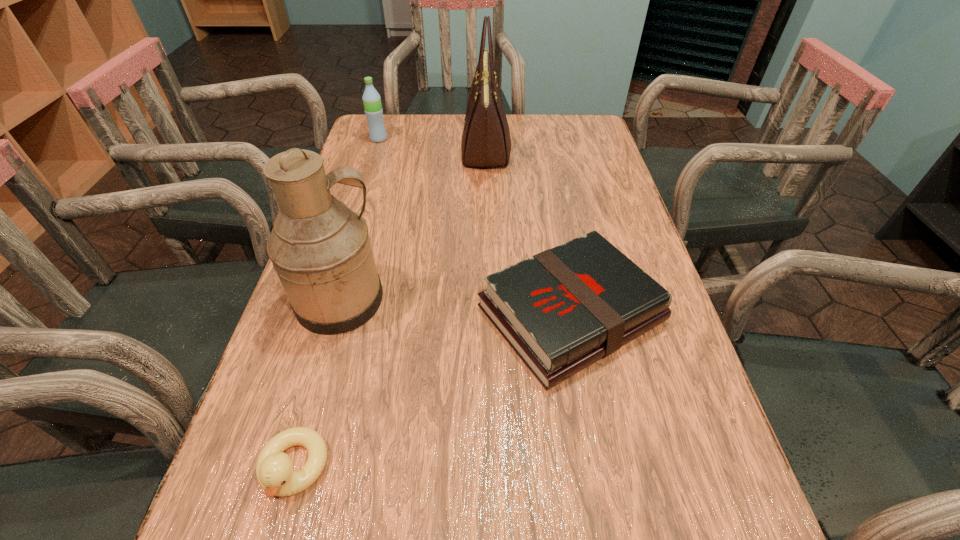
Where is `free location located 0.080m on the left of the hardback book`? free location located 0.080m on the left of the hardback book is located at coordinates (438, 314).

At what (x,y) coordinates should I click in order to perform the action: click on handbag at the far edge. Please return your answer as a coordinate pair (x, y). The height and width of the screenshot is (540, 960). Looking at the image, I should click on (486, 143).

Identify the location of water bottle located in the far edge section of the desktop. (371, 99).

Locate an element on the screen. pitcher that is at the left edge is located at coordinates (321, 250).

Where is `water bottle situated at the left edge`? Image resolution: width=960 pixels, height=540 pixels. water bottle situated at the left edge is located at coordinates (371, 99).

You are a GUI agent. You are given a task and a screenshot of the screen. Output one action in this format:
    pyautogui.click(x=<x>, y=<y>)
    Task: Click on the duckling positioned at the left edge
    The image size is (960, 540).
    Given the screenshot: What is the action you would take?
    pyautogui.click(x=274, y=469)

Find the location of `object situated at the right edge`. object situated at the right edge is located at coordinates (561, 310).

I want to click on object that is at the far left corner, so (x=371, y=99).

In the image, there is a desktop. Identify the location of vacant space at the far edge. (534, 148).

In the image, there is a desktop. At what (x,y) coordinates should I click in order to perform the action: click on vacant space at the left edge. Please return your answer as a coordinate pair (x, y). The width and height of the screenshot is (960, 540). Looking at the image, I should click on (362, 209).